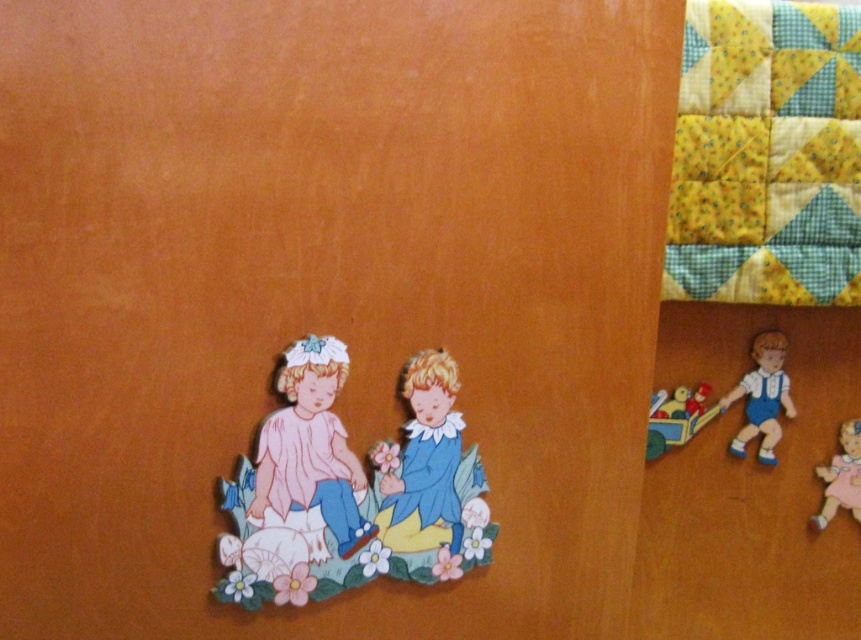
You are standing in front of a wooden surface with two children figures and a floral mat. You want to place a small vase between the matte wooden children at lower left and the floral mat. Is the distance sufficient to fit the vase?

The distance between the matte wooden children at lower left and the viewer is 3.42 feet, so yes, the vase can be placed there as there is enough space.

You are arranging a display and need to place the matte wooden children at lower left and the pink fabric doll at lower right. According to the scene, which object is positioned higher on the wooden surface?

The matte wooden children at lower left is located above the pink fabric doll at lower right, so it is positioned higher on the wooden surface.

Based on the photo, you are designing a display for a childrens museum and need to arrange the matte wooden children at lower left and the pink fabric doll at lower right. Based on their sizes, which object should be placed at the center of the display to ensure visibility for all visitors?

The matte wooden children at lower left should be placed at the center of the display because it is taller than the pink fabric doll at lower right, ensuring better visibility for all visitors.